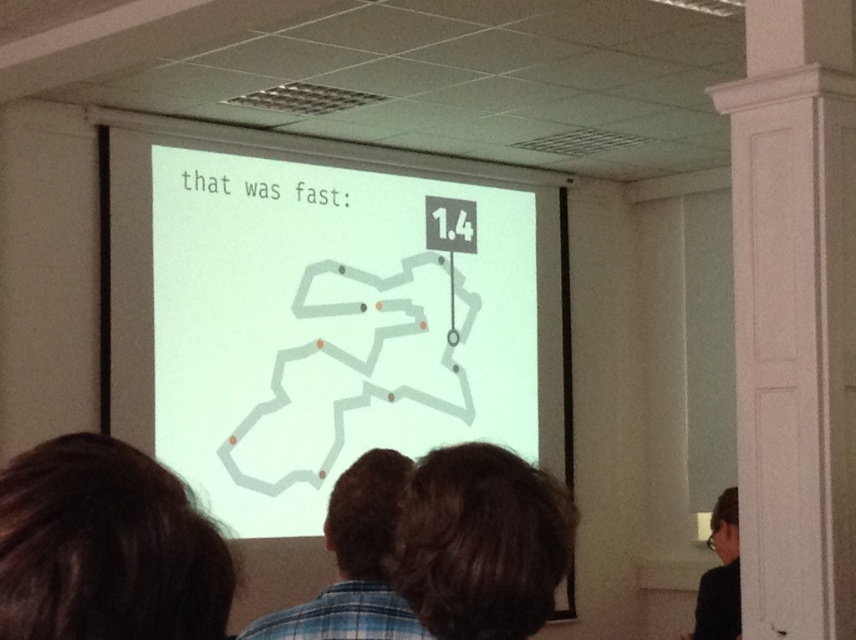
You are standing in a conference room and want to view the white matte projection screen at center clearly. The recommended viewing distance for this screen is 15 feet. Is your current distance within the recommended range?

The white matte projection screen at center and viewer are 17.41 feet apart from each other, which is beyond the recommended 15 feet viewing distance. To view the screen clearly, you should move closer to be within 15 feet.

You are an attendee sitting in the conference room and want to take a photo of the white matte projection screen at center and the white smooth pillar at right. Which object should you focus on first if you want to capture both in one frame without moving the camera?

The white matte projection screen at center is larger in size compared to the white smooth pillar at right, so you should focus on the white matte projection screen at center first to ensure it fits properly in the frame before adjusting for the smaller pillar.

You are an attendee sitting in the conference room and want to compare the size of the white smooth pillar at right and the dark brown hair at center. Which one is bigger?

The white smooth pillar at right is larger in size than the dark brown hair at center.